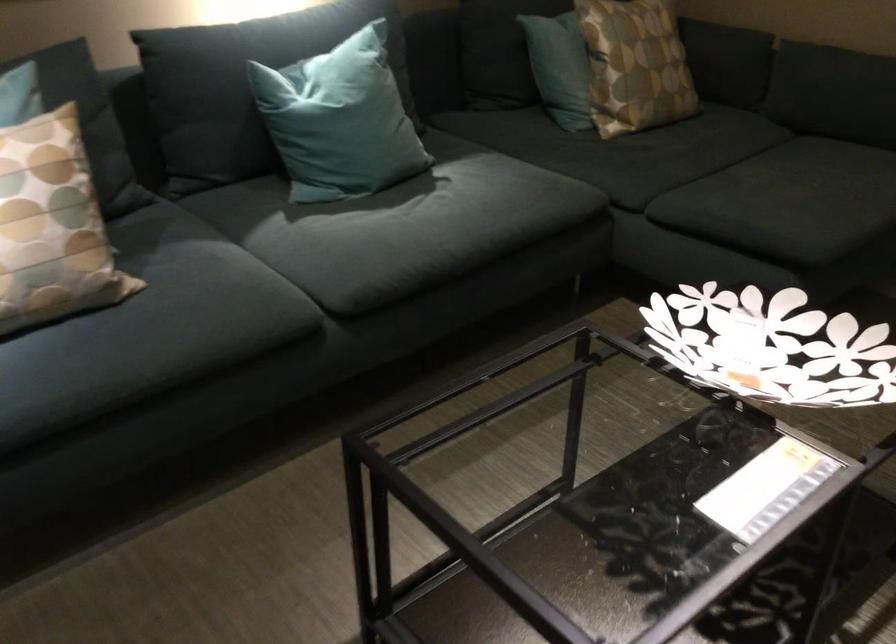
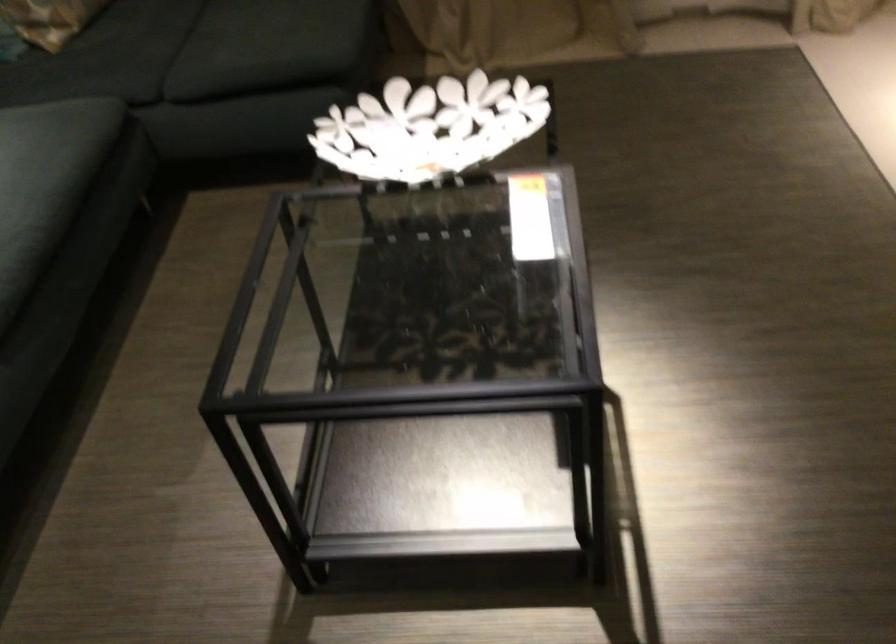
Based on the continuous images, in which direction is the camera rotating?

The camera rotated toward right-down.